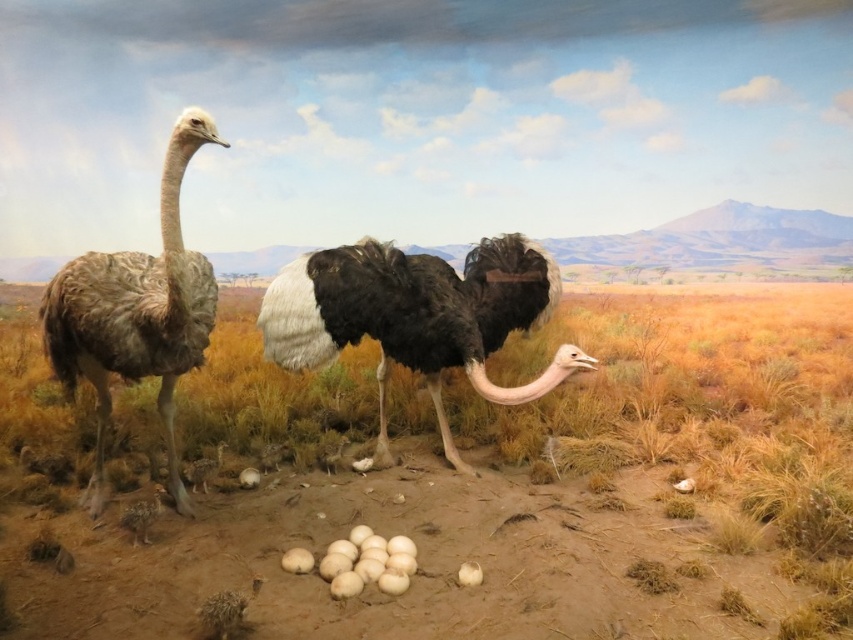
From the picture: You are an ornithologist observing the ostriches in the savanna diorama. You notice the black glossy feathers at center and the brown feathered ostrich at left. Which object is positioned higher in the scene?

The black glossy feathers at center is positioned higher than the brown feathered ostrich at left in the scene.

You are an animal caretaker in a zoo. You need to approach the brown feathered ostrich at left and the black glossy feathers at center to check their health. Which animal should you check first if you want to start with the one closer to you?

The brown feathered ostrich at left is behind the black glossy feathers at center, so you should check the black glossy feathers at center first since it is closer to you.

You are an explorer in the savanna and need to locate the black glossy feathers at center. According to the scene, where would you find them relative to the brown sandy dirt at center?

The brown sandy dirt at center is to the right of the black glossy feathers at center, so the black glossy feathers at center are located to the left of the brown sandy dirt at center.